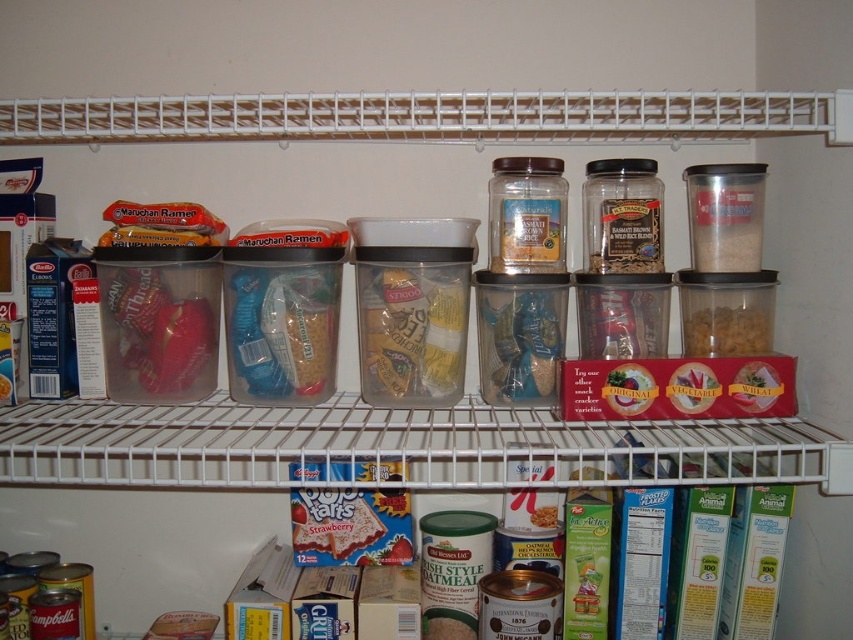
Can you confirm if clear plastic container at upper right is positioned below brown matte cereal at center right?

No.

Does point (700, 256) come behind point (734, 317)?

Yes.

The image size is (853, 640). Identify the location of clear plastic container at upper right. (724, 216).

Between point (366, 116) and point (714, 262), which one is positioned in front?

Point (714, 262) is in front.

You are a GUI agent. You are given a task and a screenshot of the screen. Output one action in this format:
    pyautogui.click(x=<x>, y=<y>)
    Task: Click on the clear plastic containers at center
    
    Given the screenshot: What is the action you would take?
    pyautogui.click(x=363, y=444)

Between translucent plastic bag of pasta at center and translucent glass jar at center, which one appears on the right side from the viewer's perspective?

translucent glass jar at center is more to the right.

Between point (397, 321) and point (646, 273), which one is positioned in front?

Point (397, 321) is in front.

Locate an element on the screen. translucent plastic bag of pasta at center is located at coordinates (410, 332).